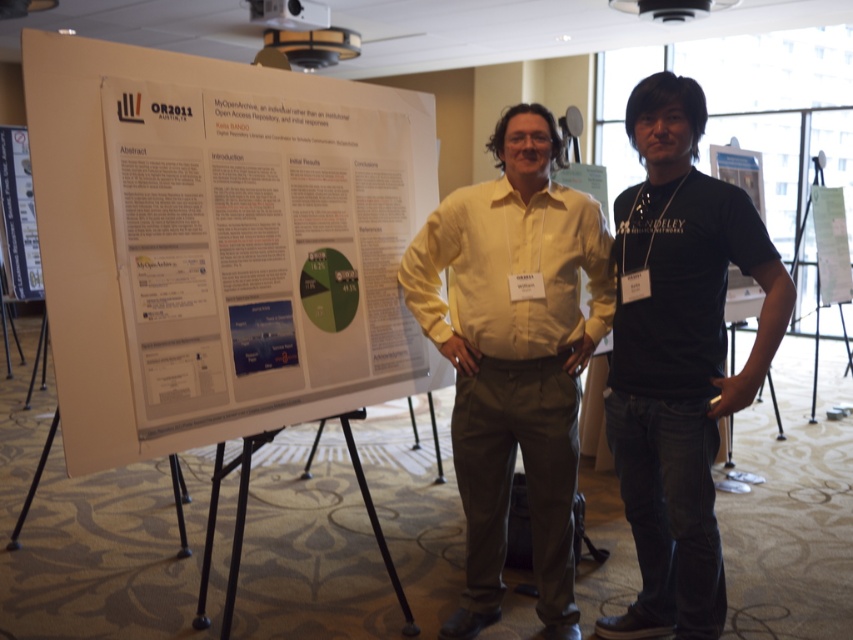
You are an event organizer checking the presentation setup. You need to ensure that the yellow matte shirt at center and the metallic silver poster at left are visible to the audience. Considering their sizes, which object might require adjustment to ensure proper visibility?

The yellow matte shirt at center has a larger size compared to metallic silver poster at left, so the metallic silver poster at left might need to be enlarged or positioned closer to ensure it is visible to the audience.

You are attending a conference and need to present your research. You have two items to display on your poster board. The metallic silver poster at left and the white paper at center. Which item is closer to the audience when viewed from the front of the board?

The metallic silver poster at left is closer to the audience because it is further to the viewer than the white paper at center, meaning it is positioned nearer to the front of the board.